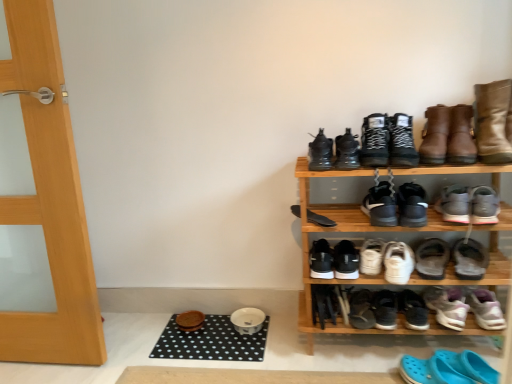
Where is `vacant location below wooden door at left (from a real-world perspective)`? vacant location below wooden door at left (from a real-world perspective) is located at coordinates (42, 364).